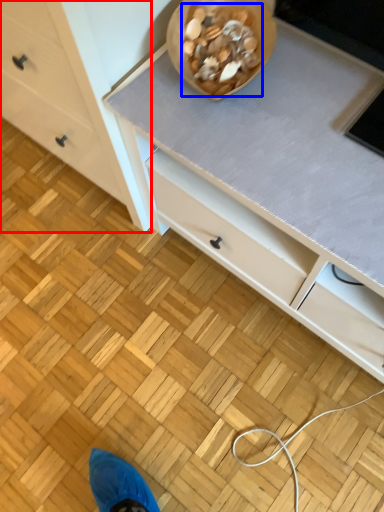
Question: Among these objects, which one is farthest to the camera, chest of drawers (highlighted by a red box) or food (highlighted by a blue box)?

Choices:
 (A) chest of drawers
 (B) food

Answer: (B)